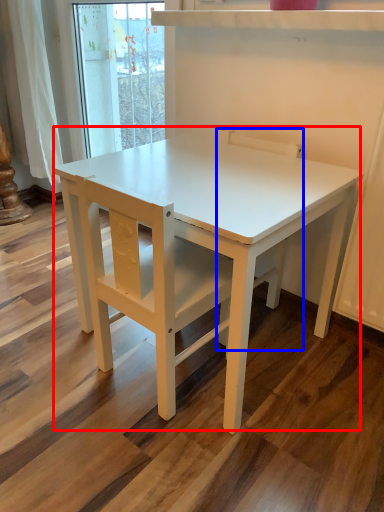
Question: Which point is closer to the camera, table (highlighted by a red box) or chair (highlighted by a blue box)?

Choices:
 (A) table
 (B) chair

Answer: (A)